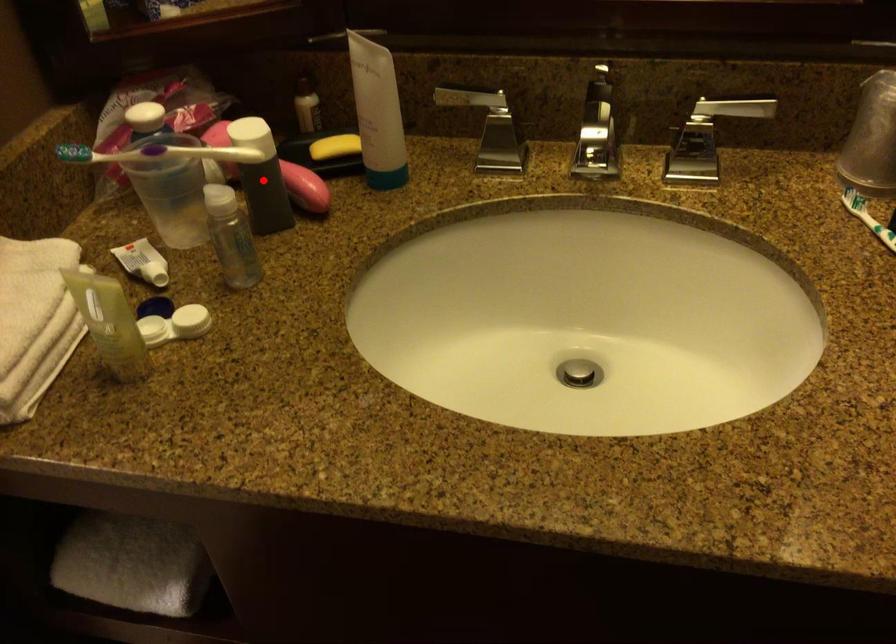
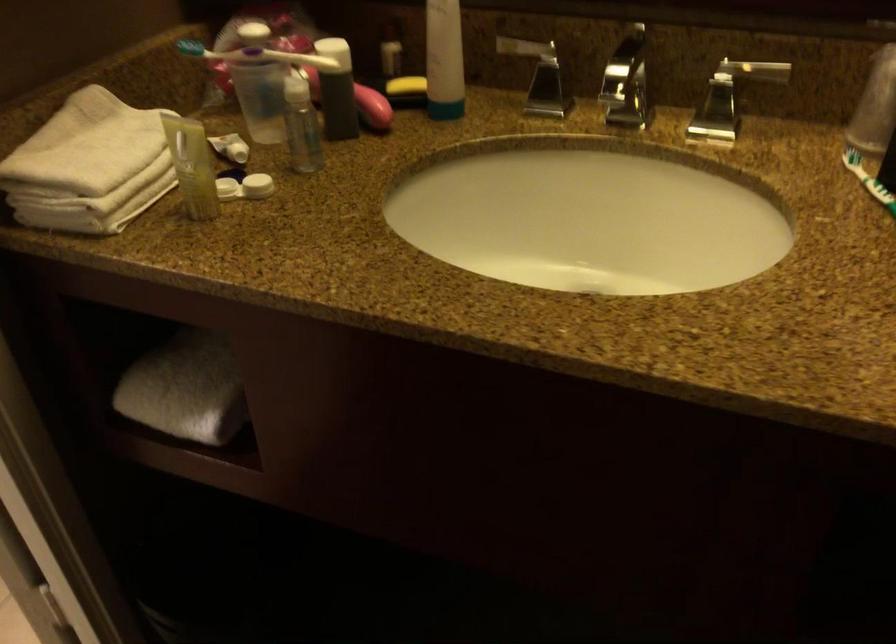
The point at the highlighted location is marked in the first image. Where is the corresponding point in the second image?

(337, 90)